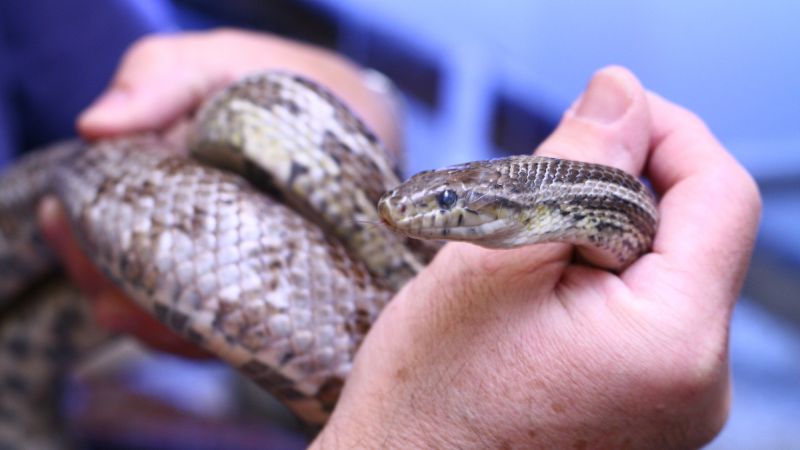
Locate an element on the screen. The height and width of the screenshot is (450, 800). scales is located at coordinates (222, 280), (229, 236), (112, 223), (90, 182), (622, 250), (298, 146).